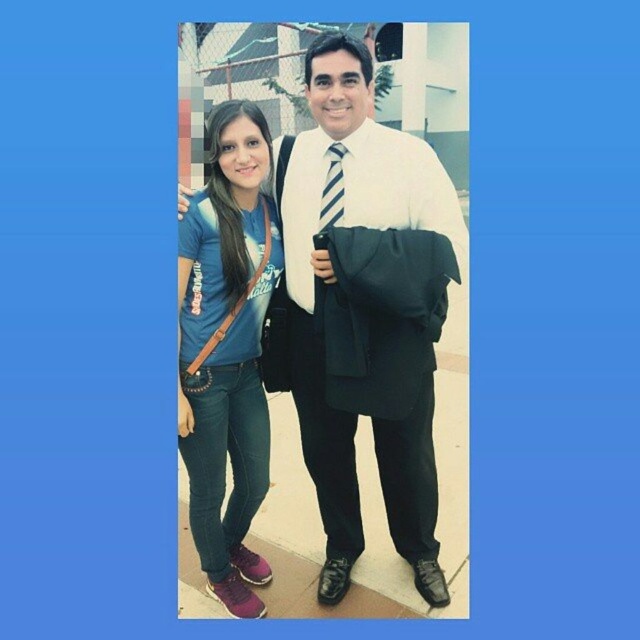
Does blue denim jeans at lower left appear on the right side of matte black jacket at center?

No, blue denim jeans at lower left is not to the right of matte black jacket at center.

From the picture: Who is positioned more to the left, blue denim jeans at lower left or matte black jacket at center?

blue denim jeans at lower left is more to the left.

Is point (268, 260) farther from viewer compared to point (390, 209)?

Yes, it is.

Identify the location of blue denim jeans at lower left. This screenshot has width=640, height=640. (227, 349).

Consider the image. Is matte black jacket at center wider than striped fabric tie at center?

Correct, the width of matte black jacket at center exceeds that of striped fabric tie at center.

Between point (358, 204) and point (339, 182), which one is positioned behind?

Positioned behind is point (339, 182).

The width and height of the screenshot is (640, 640). What do you see at coordinates (387, 168) in the screenshot?
I see `matte black jacket at center` at bounding box center [387, 168].

Where is `matte black jacket at center`? Image resolution: width=640 pixels, height=640 pixels. matte black jacket at center is located at coordinates (387, 168).

Can you confirm if blue denim jeans at lower left is bigger than striped fabric tie at center?

Yes.

Which of these two, blue denim jeans at lower left or striped fabric tie at center, stands shorter?

striped fabric tie at center

Does point (189, 314) come closer to viewer compared to point (330, 170)?

That is True.

I want to click on blue denim jeans at lower left, so click(x=227, y=349).